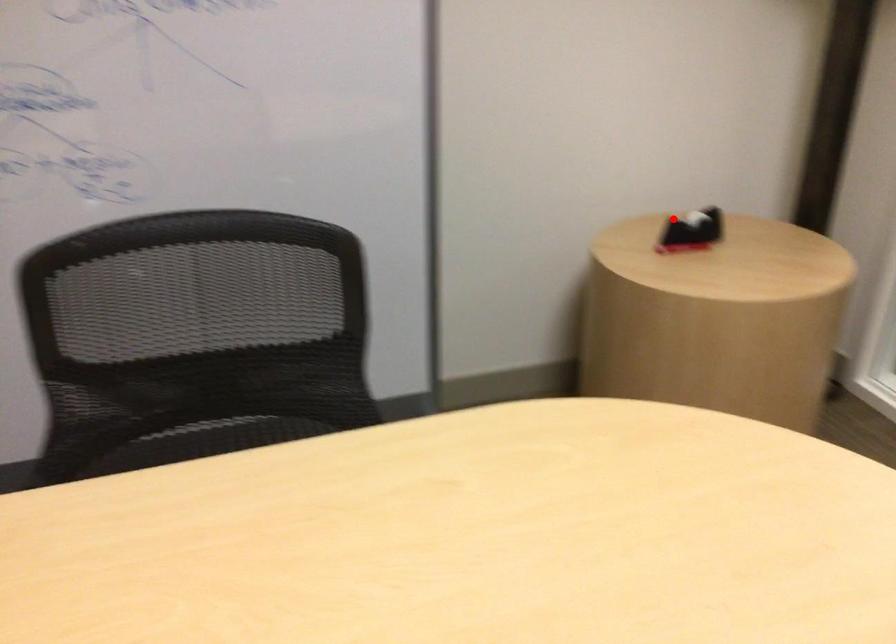
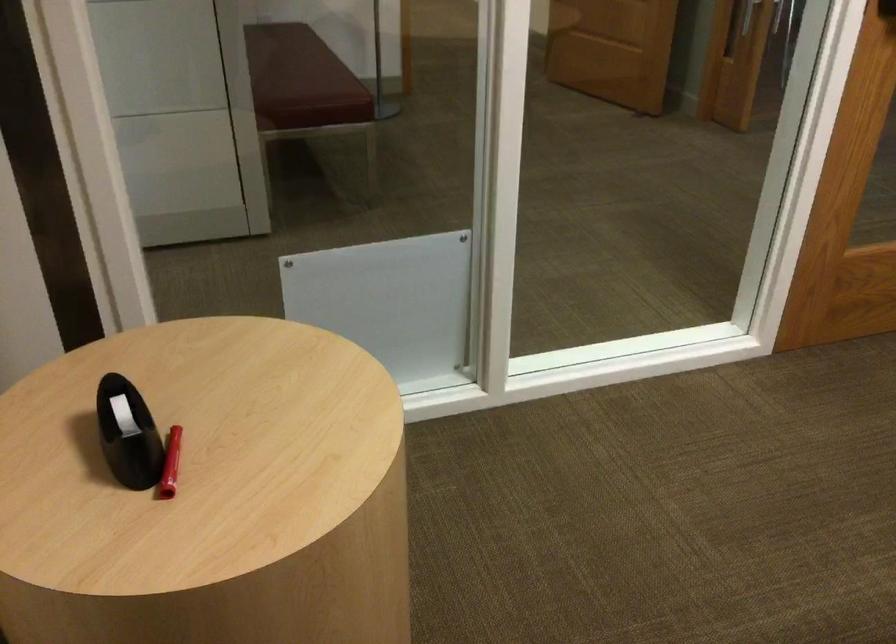
Question: I am providing you with two images of the same scene from different viewpoints. In image1, a red point is highlighted. Considering the same 3D point in image2, which of the following is correct?

Choices:
 (A) It is closer
 (B) It is farther

Answer: (A)